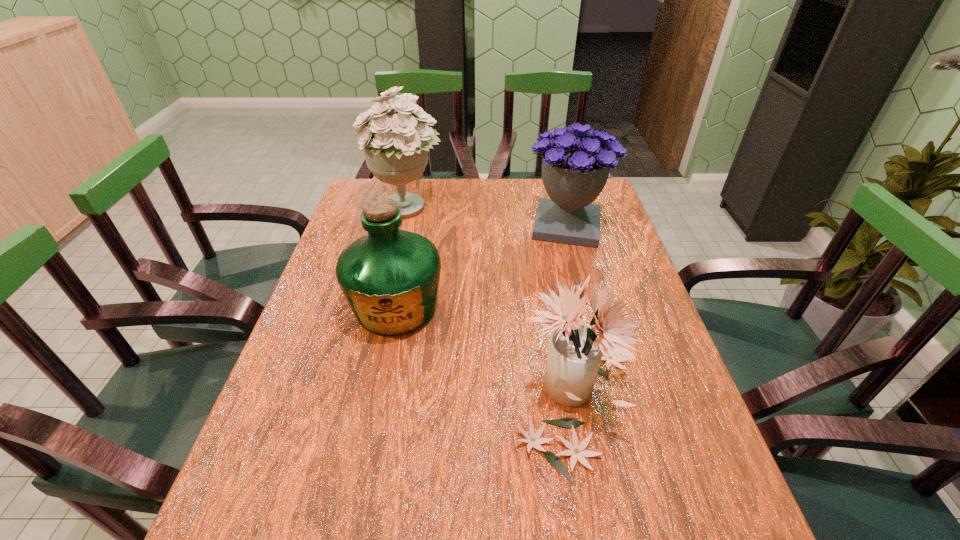
Image resolution: width=960 pixels, height=540 pixels. In order to click on object present at the far right corner in this screenshot , I will do `click(574, 172)`.

Where is `vacant space at the far edge of the desktop`? vacant space at the far edge of the desktop is located at coordinates (514, 194).

Where is `free region at the near edge of the desktop`? free region at the near edge of the desktop is located at coordinates tap(401, 535).

Image resolution: width=960 pixels, height=540 pixels. In the image, there is a desktop. In order to click on blank space at the left edge in this screenshot , I will do `click(312, 316)`.

Where is `free location at the right edge`? This screenshot has width=960, height=540. free location at the right edge is located at coordinates (644, 416).

Image resolution: width=960 pixels, height=540 pixels. What are the coordinates of `vacant space that is in between the leftmost bouquet and the shortest bouquet` in the screenshot? It's located at (492, 303).

The width and height of the screenshot is (960, 540). Find the location of `blank region between the shortest bouquet and the liquor`. blank region between the shortest bouquet and the liquor is located at coordinates (487, 353).

Locate an element on the screen. vacant space that's between the shortest bouquet and the leftmost bouquet is located at coordinates (492, 303).

Identify which object is located as the second nearest to the liquor. Please provide its 2D coordinates. Your answer should be formatted as a tuple, i.e. [(x, y)], where the tuple contains the x and y coordinates of a point satisfying the conditions above.

[(395, 145)]

Select which object is the second closest to the liquor. Please provide its 2D coordinates. Your answer should be formatted as a tuple, i.e. [(x, y)], where the tuple contains the x and y coordinates of a point satisfying the conditions above.

[(395, 145)]